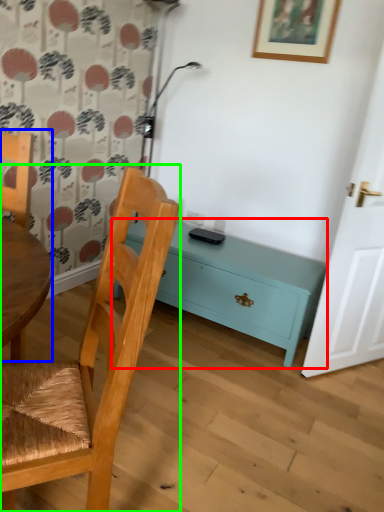
Question: Considering the real-world distances, which object is farthest from nightstand (highlighted by a red box)? chair (highlighted by a blue box) or chair (highlighted by a green box)?

Choices:
 (A) chair
 (B) chair

Answer: (B)